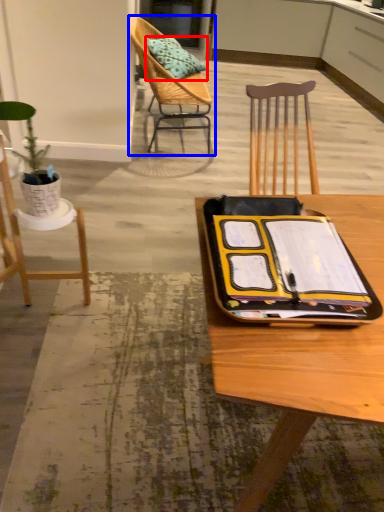
Question: Which of the following is the closest to the observer, pillow (highlighted by a red box) or chair (highlighted by a blue box)?

Choices:
 (A) pillow
 (B) chair

Answer: (B)